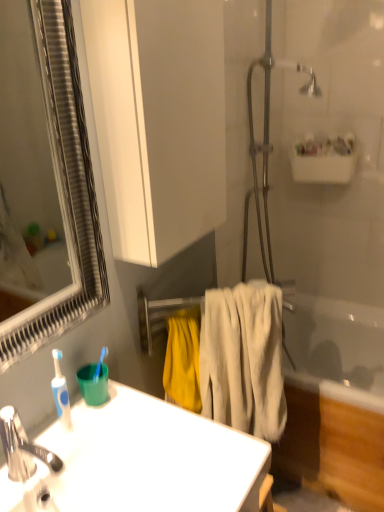
Question: Is silver-framed mirror at left beside metallic silver towel rack at center?

Choices:
 (A) no
 (B) yes

Answer: (A)

Question: From the image's perspective, does silver-framed mirror at left appear lower than metallic silver towel rack at center?

Choices:
 (A) no
 (B) yes

Answer: (A)

Question: Is the position of silver-framed mirror at left less distant than that of metallic silver towel rack at center?

Choices:
 (A) no
 (B) yes

Answer: (B)

Question: From a real-world perspective, is silver-framed mirror at left positioned over metallic silver towel rack at center based on gravity?

Choices:
 (A) no
 (B) yes

Answer: (B)

Question: Is metallic silver towel rack at center located within silver-framed mirror at left?

Choices:
 (A) yes
 (B) no

Answer: (B)

Question: Does point (150, 316) appear closer or farther from the camera than point (23, 474)?

Choices:
 (A) farther
 (B) closer

Answer: (A)

Question: Is metallic silver towel rack at center in front of or behind polished chrome faucet at lower left in the image?

Choices:
 (A) behind
 (B) front

Answer: (A)

Question: Considering the positions of metallic silver towel rack at center and polished chrome faucet at lower left in the image, is metallic silver towel rack at center wider or thinner than polished chrome faucet at lower left?

Choices:
 (A) wide
 (B) thin

Answer: (B)

Question: From their relative heights in the image, would you say metallic silver towel rack at center is taller or shorter than polished chrome faucet at lower left?

Choices:
 (A) short
 (B) tall

Answer: (B)

Question: From their relative heights in the image, would you say metallic silver towel rack at center is taller or shorter than white matte cabinet at upper center?

Choices:
 (A) tall
 (B) short

Answer: (B)

Question: Considering the positions of metallic silver towel rack at center and white matte cabinet at upper center in the image, is metallic silver towel rack at center bigger or smaller than white matte cabinet at upper center?

Choices:
 (A) small
 (B) big

Answer: (A)

Question: Is point coord(162,323) positioned closer to the camera than point coord(160,139)?

Choices:
 (A) closer
 (B) farther

Answer: (B)

Question: Considering their positions, is metallic silver towel rack at center located in front of or behind white matte cabinet at upper center?

Choices:
 (A) front
 (B) behind

Answer: (B)

Question: In terms of height, does polished chrome faucet at lower left look taller or shorter compared to white glossy sink at lower left?

Choices:
 (A) short
 (B) tall

Answer: (B)

Question: Is polished chrome faucet at lower left to the left or to the right of white glossy sink at lower left in the image?

Choices:
 (A) right
 (B) left

Answer: (B)